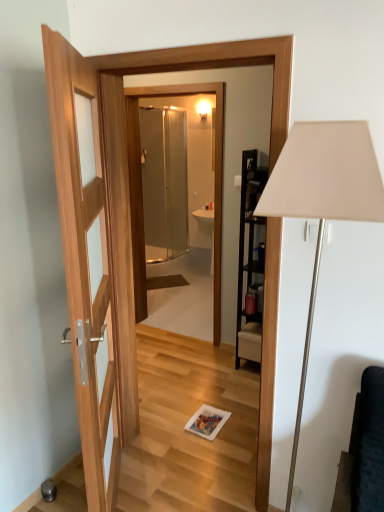
Question: Is white matte floor lamp at right far from transparent glass shower at center?

Choices:
 (A) yes
 (B) no

Answer: (A)

Question: Can you confirm if white matte floor lamp at right is thinner than transparent glass shower at center?

Choices:
 (A) no
 (B) yes

Answer: (A)

Question: Could you tell me if white matte floor lamp at right is turned towards transparent glass shower at center?

Choices:
 (A) no
 (B) yes

Answer: (A)

Question: From a real-world perspective, is white matte floor lamp at right physically above transparent glass shower at center?

Choices:
 (A) yes
 (B) no

Answer: (B)

Question: Is white matte floor lamp at right not inside transparent glass shower at center?

Choices:
 (A) yes
 (B) no

Answer: (A)

Question: From the image's perspective, is white matte floor lamp at right above or below clear glass shower door at center?

Choices:
 (A) above
 (B) below

Answer: (B)

Question: In terms of width, does white matte floor lamp at right look wider or thinner when compared to clear glass shower door at center?

Choices:
 (A) wide
 (B) thin

Answer: (B)

Question: Considering their positions, is white matte floor lamp at right located in front of or behind clear glass shower door at center?

Choices:
 (A) front
 (B) behind

Answer: (A)

Question: From a real-world perspective, is white matte floor lamp at right above or below clear glass shower door at center?

Choices:
 (A) below
 (B) above

Answer: (A)

Question: From a real-world perspective, is transparent glass shower at center positioned above or below clear glass shower door at center?

Choices:
 (A) below
 (B) above

Answer: (A)

Question: Considering the positions of transparent glass shower at center and clear glass shower door at center in the image, is transparent glass shower at center bigger or smaller than clear glass shower door at center?

Choices:
 (A) small
 (B) big

Answer: (A)

Question: Which is correct: transparent glass shower at center is inside clear glass shower door at center, or outside of it?

Choices:
 (A) outside
 (B) inside

Answer: (A)

Question: Considering the positions of transparent glass shower at center and clear glass shower door at center in the image, is transparent glass shower at center taller or shorter than clear glass shower door at center?

Choices:
 (A) tall
 (B) short

Answer: (A)

Question: Choose the correct answer: Is transparent glass shower at center inside white matte floor lamp at right or outside it?

Choices:
 (A) inside
 (B) outside

Answer: (B)

Question: From a real-world perspective, relative to white matte floor lamp at right, is transparent glass shower at center vertically above or below?

Choices:
 (A) above
 (B) below

Answer: (A)